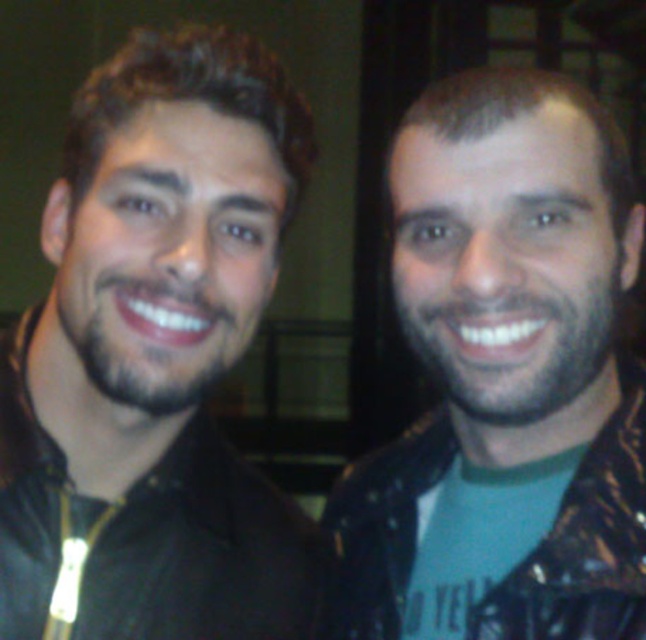
Looking at this image, does black leather jacket at left appear over leather jacket at right?

Yes.

Is black leather jacket at left further to camera compared to leather jacket at right?

Yes, it is behind leather jacket at right.

Who is more forward, (87, 371) or (373, 488)?

Point (87, 371) is in front.

The image size is (646, 640). I want to click on black leather jacket at left, so click(x=154, y=358).